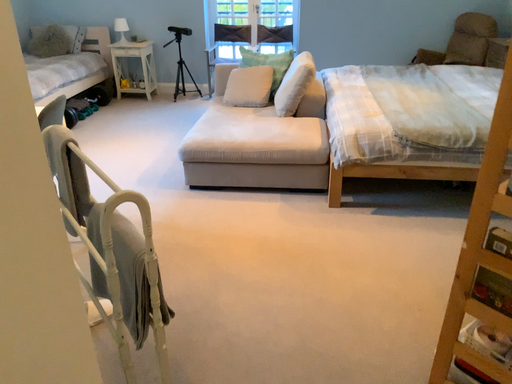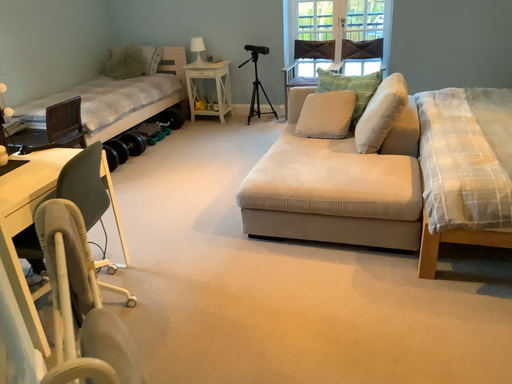
Question: How did the camera likely rotate when shooting the video?

Choices:
 (A) rotated right
 (B) rotated left

Answer: (B)